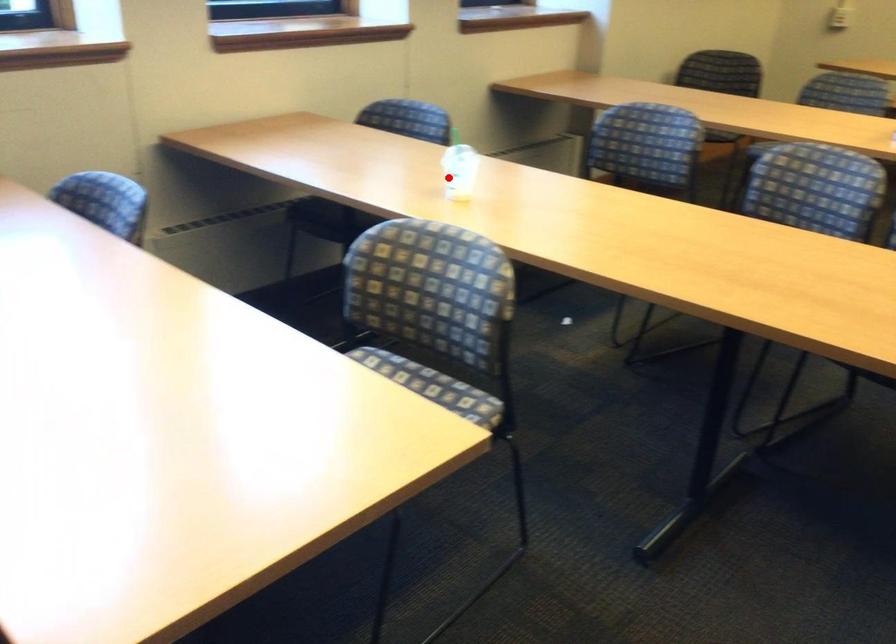
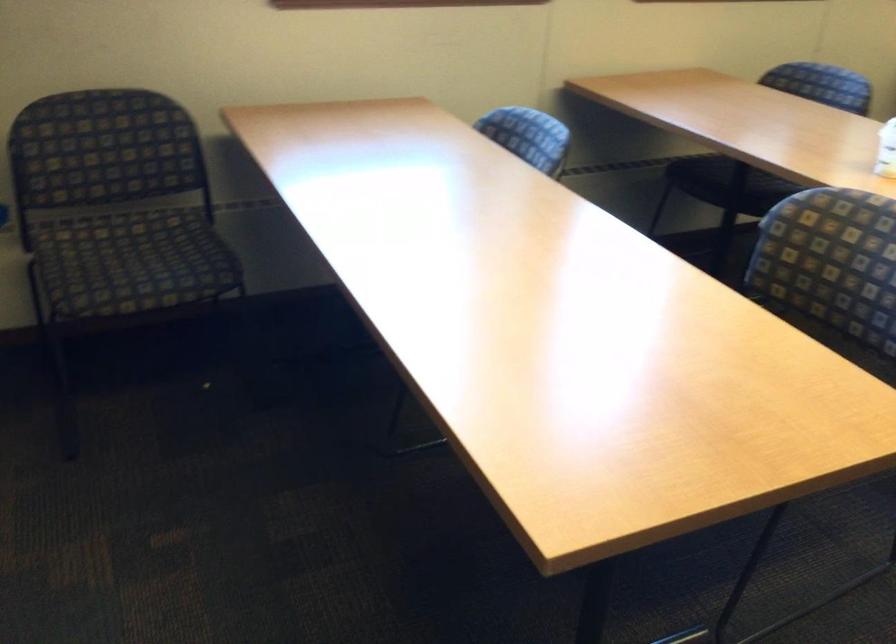
Locate, in the second image, the point that corresponds to the highlighted location in the first image.

(885, 149)